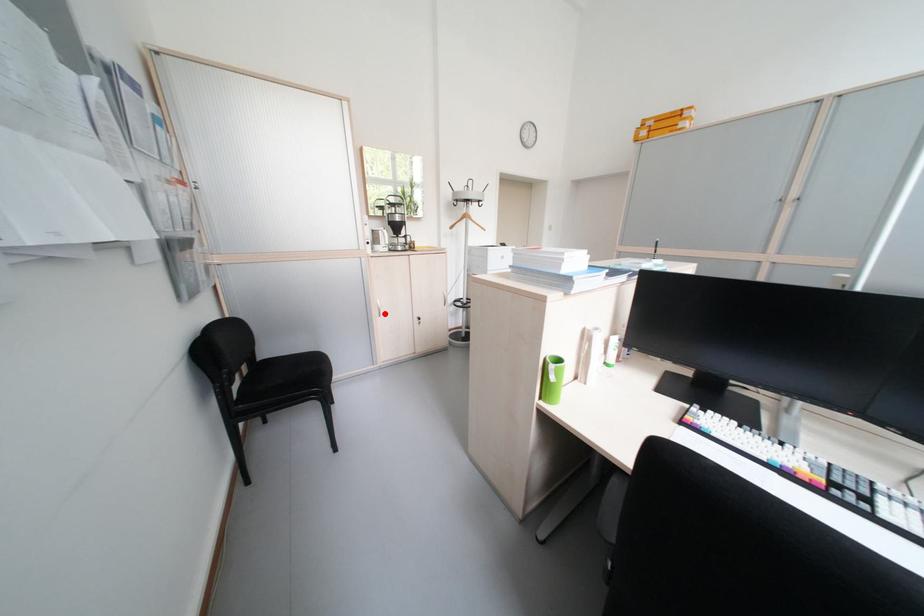
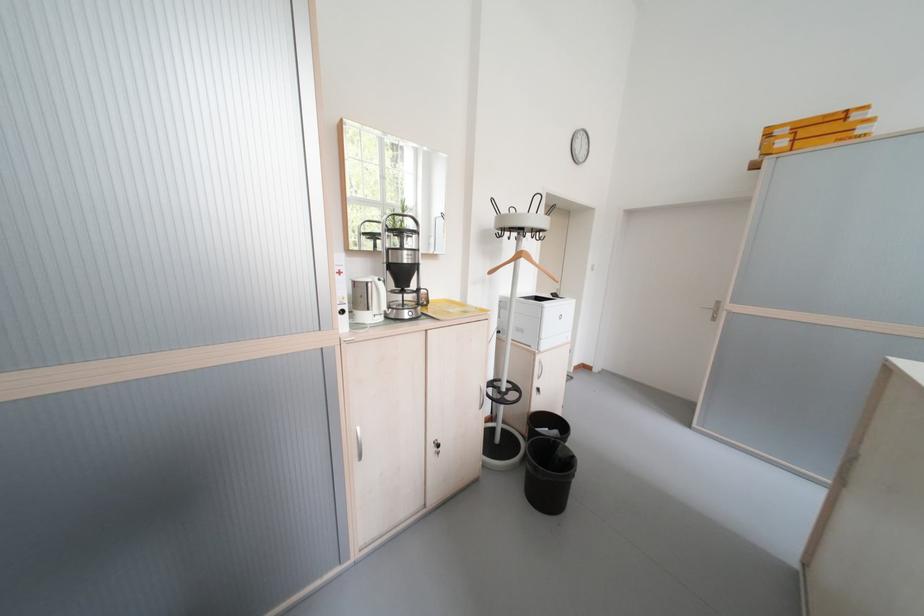
Question: I am providing you with two images of the same scene from different viewpoints. A red point is shown in image1. For the corresponding object point in image2, is it positioned nearer or farther from the camera?

Choices:
 (A) Nearer
 (B) Farther

Answer: (B)